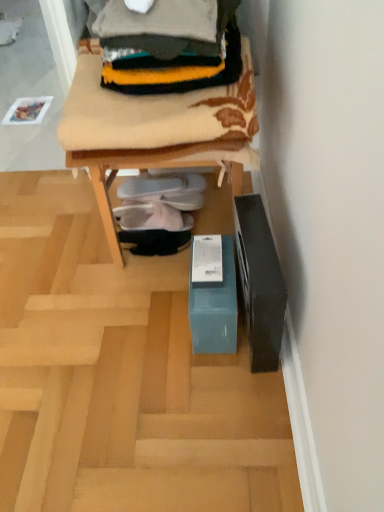
The width and height of the screenshot is (384, 512). Identify the location of free point to the left of teal cardboard box at lower center. (54, 239).